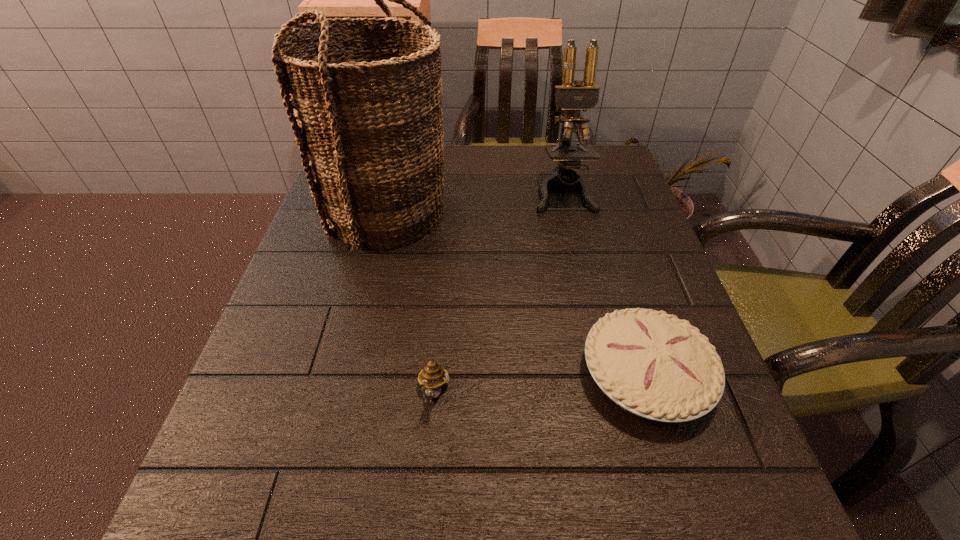
You are a GUI agent. You are given a task and a screenshot of the screen. Output one action in this format:
    pyautogui.click(x=<x>, y=<y>)
    Task: Click on the closest object to the tallest object
    This screenshot has height=540, width=960.
    Given the screenshot: What is the action you would take?
    pyautogui.click(x=572, y=98)

The image size is (960, 540). I want to click on object that is the closest to the snail, so click(650, 363).

Locate an element on the screen. Image resolution: width=960 pixels, height=540 pixels. blank space that satisfies the following two spatial constraints: 1. at the eyepieces of the second tallest object; 2. on the right side of the shortest object is located at coordinates (606, 375).